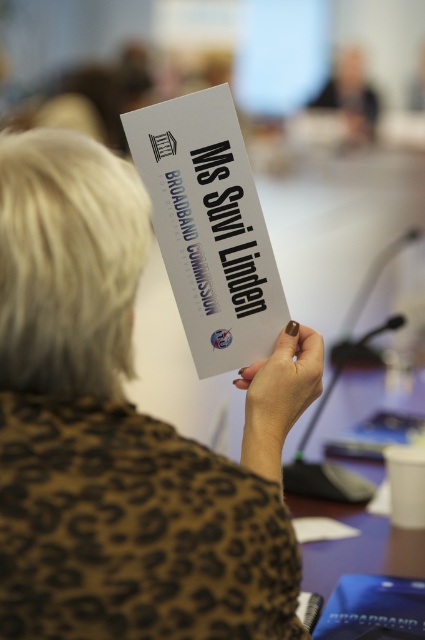
You are organizing a conference and need to place a name tag on a table. The table has a space that can only accommodate items up to the size of the nail polish at center. Can the white paper at center fit in that space?

The white paper at center is larger than the nail polish at center, so it cannot fit in the space designated for items up to the size of the nail polish at center.